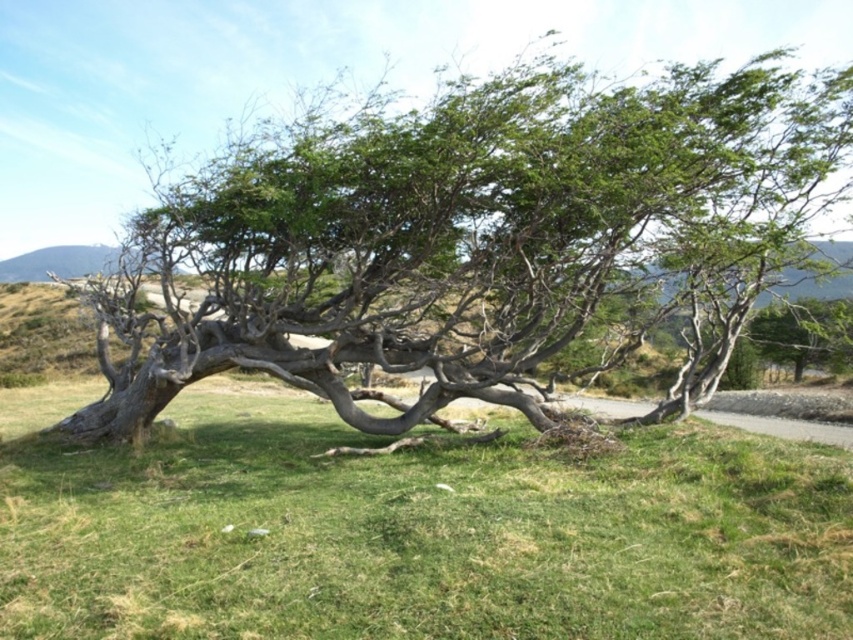
Question: Which object appears farthest from the camera in this image?

Choices:
 (A) green grass at center
 (B) green leafy tree at center
 (C) green rough bark tree at center

Answer: (B)

Question: Among these points, which one is nearest to the camera?

Choices:
 (A) (772, 356)
 (B) (347, 420)

Answer: (B)

Question: Is green grass at center positioned behind green leafy tree at center?

Choices:
 (A) no
 (B) yes

Answer: (A)

Question: Among these objects, which one is farthest from the camera?

Choices:
 (A) green rough bark tree at center
 (B) green grass at center

Answer: (A)

Question: Is green rough bark tree at center bigger than green leafy tree at center?

Choices:
 (A) no
 (B) yes

Answer: (A)

Question: Does green rough bark tree at center appear over green grass at center?

Choices:
 (A) no
 (B) yes

Answer: (B)